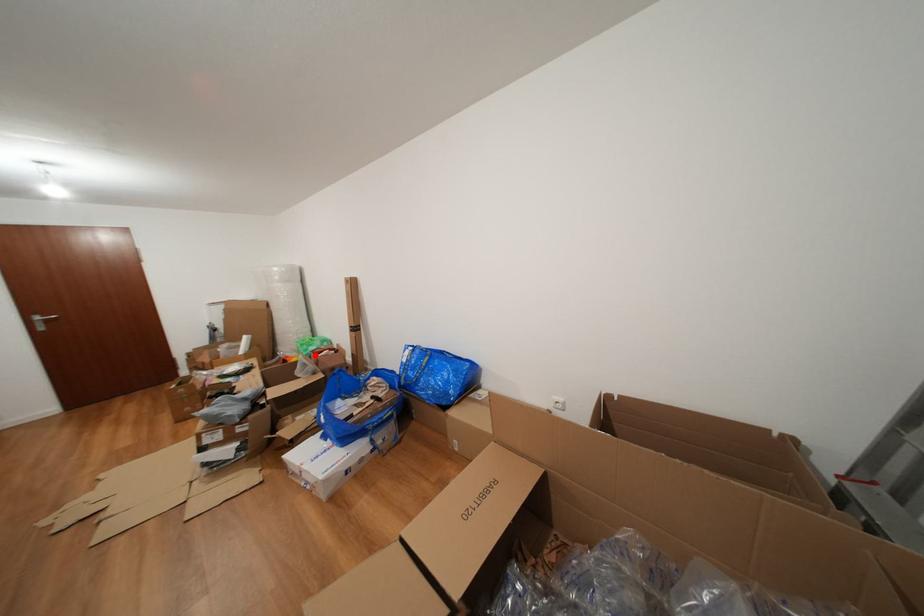
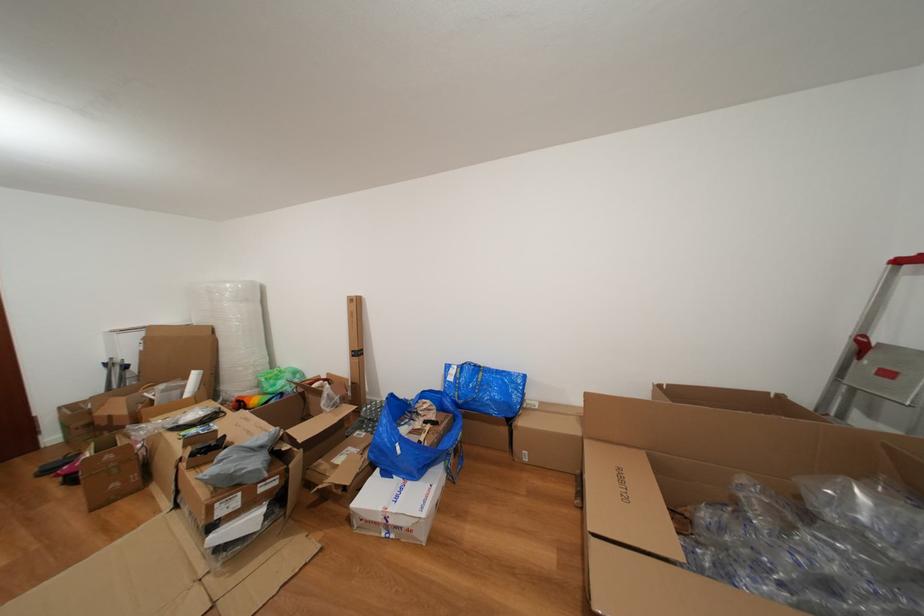
Question: I am providing you with two images of the same scene from different viewpoints. Image1 has a red point marked. In image2, the corresponding 3D location appears at what relative position? Reply with the corresponding letter.

Choices:
 (A) Closer
 (B) Farther

Answer: (A)